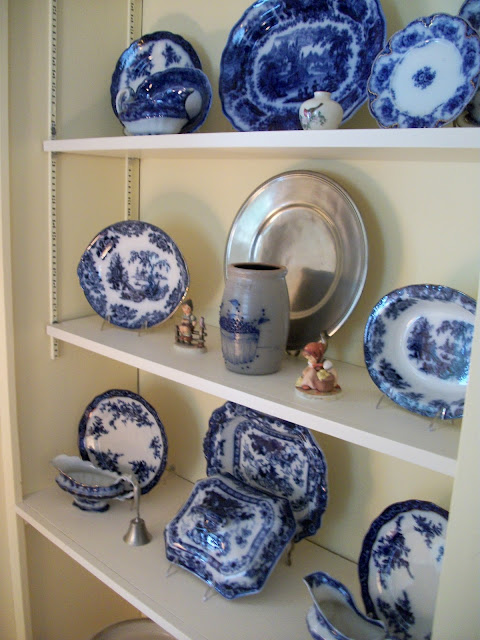
The image size is (480, 640). Find the location of `figurines`. figurines is located at coordinates (185, 326), (313, 377).